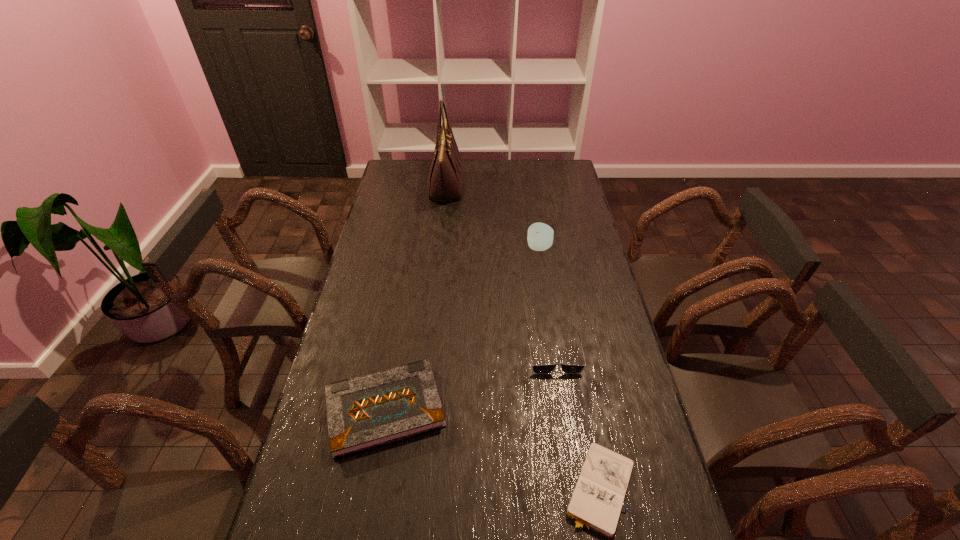
You are a GUI agent. You are given a task and a screenshot of the screen. Output one action in this format:
    pyautogui.click(x=<x>, y=<y>)
    Task: Click on the vacant area between the farthest object and the shortest object
    
    Given the screenshot: What is the action you would take?
    pyautogui.click(x=522, y=338)

Find the location of a particular element. The height and width of the screenshot is (540, 960). the fourth closest object to the handbag is located at coordinates (596, 502).

Select which object is the fourth closest to the right notebook. Please provide its 2D coordinates. Your answer should be formatted as a tuple, i.e. [(x, y)], where the tuple contains the x and y coordinates of a point satisfying the conditions above.

[(445, 179)]

The image size is (960, 540). What are the coordinates of `vacant area that satisfies the following two spatial constraints: 1. on the front-facing side of the handbag; 2. on the right side of the second farthest object` in the screenshot? It's located at (440, 248).

Where is `free spot that satisfies the following two spatial constraints: 1. on the back side of the right notebook; 2. on the front-facing side of the handbag`? free spot that satisfies the following two spatial constraints: 1. on the back side of the right notebook; 2. on the front-facing side of the handbag is located at coordinates (542, 187).

Locate an element on the screen. free spot that satisfies the following two spatial constraints: 1. on the front-facing side of the shortest object; 2. on the left side of the sunglasses is located at coordinates (575, 488).